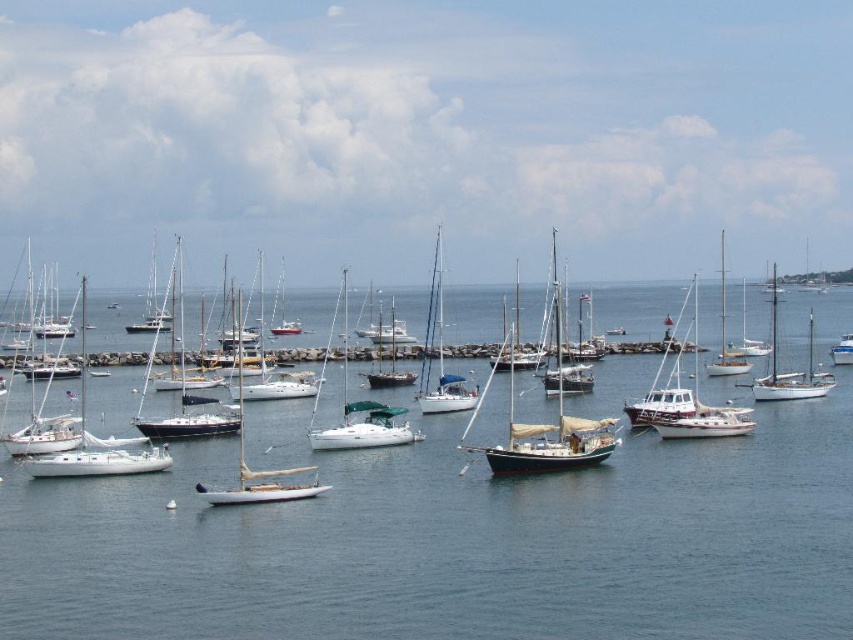
Is dark brown wooden sailboat at center taller than white matte sailboat at center-right?

Correct, dark brown wooden sailboat at center is much taller as white matte sailboat at center-right.

How much distance is there between dark brown wooden sailboat at center and white matte sailboat at center-right?

A distance of 30.33 meters exists between dark brown wooden sailboat at center and white matte sailboat at center-right.

Who is more forward, (606, 440) or (840, 342)?

Point (606, 440) is in front.

The width and height of the screenshot is (853, 640). What are the coordinates of `dark brown wooden sailboat at center` in the screenshot? It's located at (549, 442).

Measure the distance between point (x=473, y=602) and camera.

The distance of point (x=473, y=602) from camera is 31.74 meters.

Which is above, blue water at center or dark brown wooden sailboat at center?

dark brown wooden sailboat at center is above.

Which is in front, point (810, 596) or point (614, 422)?

Positioned in front is point (810, 596).

Locate an element on the screen. blue water at center is located at coordinates (450, 541).

Can you confirm if blue water at center is positioned above white matte sailboat at center-right?

Yes, blue water at center is above white matte sailboat at center-right.

Is blue water at center positioned at the back of white matte sailboat at center-right?

No, blue water at center is in front of white matte sailboat at center-right.

Who is more distant from viewer, (119, 609) or (842, 337)?

Positioned behind is point (842, 337).

The height and width of the screenshot is (640, 853). I want to click on blue water at center, so click(x=450, y=541).